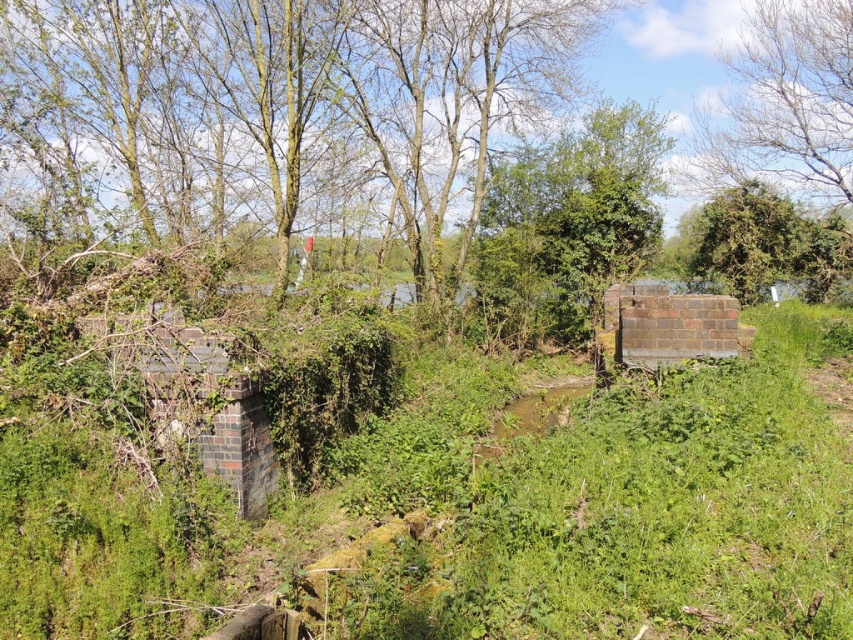
Is green leafy grass at center behind green leafy tree at center?

That is False.

Between point (219, 506) and point (495, 307), which one is positioned behind?

The point (495, 307) is behind.

In order to click on green leafy grass at center in this screenshot , I will do `click(613, 502)`.